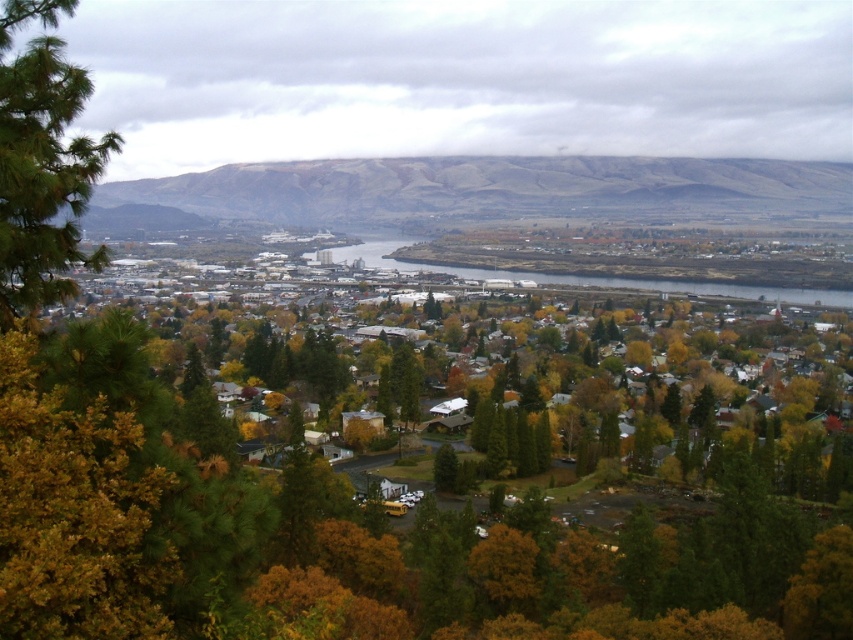
Question: Is brown/dry soil at upper center further to the viewer compared to green pine tree at left?

Choices:
 (A) no
 (B) yes

Answer: (B)

Question: Does brown/dry soil at upper center have a greater width compared to green pine tree at left?

Choices:
 (A) yes
 (B) no

Answer: (A)

Question: Which object is closer to the camera taking this photo?

Choices:
 (A) brown/dry soil at upper center
 (B) green pine tree at left

Answer: (B)

Question: Which of the following is the closest to the observer?

Choices:
 (A) (621, 193)
 (B) (61, 248)

Answer: (B)

Question: Does brown/dry soil at upper center have a smaller size compared to green pine tree at left?

Choices:
 (A) yes
 (B) no

Answer: (B)

Question: Which of the following is the closest to the observer?

Choices:
 (A) green pine tree at left
 (B) brown/dry soil at upper center

Answer: (A)